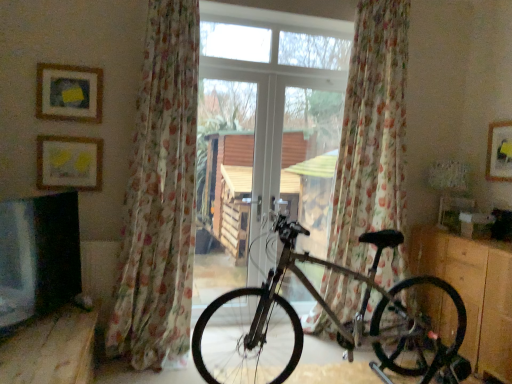
Describe the element at coordinates (499, 152) in the screenshot. I see `matte yellow picture frame at upper right, the 1th picture frame in the right-to-left sequence` at that location.

The height and width of the screenshot is (384, 512). What are the coordinates of `floral sheer curtain at left, the second curtain when ordered from right to left` in the screenshot? It's located at (160, 198).

In order to face floral sheer curtain at center, the 1th curtain positioned from the right, should I rotate leftwards or rightwards?

To align with it, rotate right about 15.535°.

At what (x,y) coordinates should I click in order to perform the action: click on silver metallic bicycle at center. Please return your answer as a coordinate pair (x, y). The width and height of the screenshot is (512, 384). Looking at the image, I should click on (329, 317).

What do you see at coordinates (329, 317) in the screenshot? This screenshot has width=512, height=384. I see `silver metallic bicycle at center` at bounding box center [329, 317].

The image size is (512, 384). I want to click on wooden dresser at lower right, so click(473, 292).

Is matte yellow picture frame at upper left, placed as the second picture frame when sorted from back to front, in front of or behind floral sheer curtain at center, which is counted as the 2th curtain, starting from the left, in the image?

matte yellow picture frame at upper left, placed as the second picture frame when sorted from back to front, is in front of floral sheer curtain at center, which is counted as the 2th curtain, starting from the left.

Considering the sizes of matte yellow picture frame at upper left, placed as the second picture frame when sorted from back to front, and floral sheer curtain at center, which is counted as the 2th curtain, starting from the left, in the image, is matte yellow picture frame at upper left, placed as the second picture frame when sorted from back to front, wider or thinner than floral sheer curtain at center, which is counted as the 2th curtain, starting from the left,?

matte yellow picture frame at upper left, placed as the second picture frame when sorted from back to front, is thinner than floral sheer curtain at center, which is counted as the 2th curtain, starting from the left.

Between matte yellow picture frame at upper left, marked as the third picture frame in a right-to-left arrangement, and floral sheer curtain at center, which is counted as the 2th curtain, starting from the left, which one has larger size?

floral sheer curtain at center, which is counted as the 2th curtain, starting from the left.

From the picture: From a real-world perspective, which object rests below the other?

matte yellow picture frame at upper left, marked as the third picture frame in a right-to-left arrangement, is physically lower.

Is transparent glass door at center looking in the opposite direction of matte gold picture frame at upper left, positioned as the 3th picture frame in back-to-front order?

No, transparent glass door at center is not facing the opposite direction of matte gold picture frame at upper left, positioned as the 3th picture frame in back-to-front order.

How distant is transparent glass door at center from matte gold picture frame at upper left, positioned as the 3th picture frame in back-to-front order?

A distance of 38.44 inches exists between transparent glass door at center and matte gold picture frame at upper left, positioned as the 3th picture frame in back-to-front order.

Are transparent glass door at center and matte gold picture frame at upper left, which ranks as the 1th picture frame in front-to-back order, making contact?

No, transparent glass door at center is not beside matte gold picture frame at upper left, which ranks as the 1th picture frame in front-to-back order.

Considering the sizes of transparent glass door at center and matte gold picture frame at upper left, which ranks as the 1th picture frame in front-to-back order, in the image, is transparent glass door at center taller or shorter than matte gold picture frame at upper left, which ranks as the 1th picture frame in front-to-back order,?

In the image, transparent glass door at center appears to be taller than matte gold picture frame at upper left, which ranks as the 1th picture frame in front-to-back order.

From the image's perspective, which one is positioned lower, matte gold picture frame at upper left, positioned as the 3th picture frame in back-to-front order, or wooden bench at lower left?

From the image's view, wooden bench at lower left is below.

Locate an element on the screen. This screenshot has width=512, height=384. the 3rd picture frame above when counting from the wooden bench at lower left (from the image's perspective) is located at coordinates (69, 93).

Is matte gold picture frame at upper left, the second picture frame in the right-to-left sequence, in front of wooden bench at lower left?

No.

From their relative heights in the image, would you say matte gold picture frame at upper left, positioned as the 3th picture frame in back-to-front order, is taller or shorter than wooden bench at lower left?

Clearly, matte gold picture frame at upper left, positioned as the 3th picture frame in back-to-front order, is shorter compared to wooden bench at lower left.

Is matte gold picture frame at upper left, the second picture frame in the right-to-left sequence, aimed at matte yellow picture frame at upper left, marked as the 2th picture frame in a front-to-back arrangement?

No, matte gold picture frame at upper left, the second picture frame in the right-to-left sequence, is not facing towards matte yellow picture frame at upper left, marked as the 2th picture frame in a front-to-back arrangement.

Is matte gold picture frame at upper left, positioned as the 3th picture frame in back-to-front order, not close to matte yellow picture frame at upper left, marked as the third picture frame in a right-to-left arrangement?

matte gold picture frame at upper left, positioned as the 3th picture frame in back-to-front order, is actually quite close to matte yellow picture frame at upper left, marked as the third picture frame in a right-to-left arrangement.

Is matte gold picture frame at upper left, which ranks as the 1th picture frame in front-to-back order, behind matte yellow picture frame at upper left, which is the first picture frame from left to right?

No, it is not.

From a real-world perspective, is floral sheer curtain at left, the second curtain when ordered from right to left, physically located above or below silver metallic bicycle at center?

In terms of real-world spatial position, floral sheer curtain at left, the second curtain when ordered from right to left, is above silver metallic bicycle at center.

Considering the sizes of objects floral sheer curtain at left, which is counted as the first curtain, starting from the left, and silver metallic bicycle at center in the image provided, who is shorter, floral sheer curtain at left, which is counted as the first curtain, starting from the left, or silver metallic bicycle at center?

Standing shorter between the two is silver metallic bicycle at center.

Considering the relative sizes of floral sheer curtain at left, which is counted as the first curtain, starting from the left, and silver metallic bicycle at center in the image provided, is floral sheer curtain at left, which is counted as the first curtain, starting from the left, thinner than silver metallic bicycle at center?

Correct, the width of floral sheer curtain at left, which is counted as the first curtain, starting from the left, is less than that of silver metallic bicycle at center.

Is floral sheer curtain at left, the second curtain when ordered from right to left, bigger or smaller than silver metallic bicycle at center?

Clearly, floral sheer curtain at left, the second curtain when ordered from right to left, is smaller in size than silver metallic bicycle at center.

Considering the sizes of floral sheer curtain at left, which is counted as the first curtain, starting from the left, and wooden dresser at lower right in the image, is floral sheer curtain at left, which is counted as the first curtain, starting from the left, wider or thinner than wooden dresser at lower right?

Considering their sizes, floral sheer curtain at left, which is counted as the first curtain, starting from the left, looks slimmer than wooden dresser at lower right.

Where is `dresser that is under the floral sheer curtain at left, which is counted as the first curtain, starting from the left (from a real-world perspective)`? dresser that is under the floral sheer curtain at left, which is counted as the first curtain, starting from the left (from a real-world perspective) is located at coordinates (473, 292).

Is floral sheer curtain at left, the second curtain when ordered from right to left, touching wooden dresser at lower right?

floral sheer curtain at left, the second curtain when ordered from right to left, is not next to wooden dresser at lower right, and they're not touching.

Is floral sheer curtain at left, which is counted as the first curtain, starting from the left, spatially inside wooden dresser at lower right, or outside of it?

floral sheer curtain at left, which is counted as the first curtain, starting from the left, is located beyond the bounds of wooden dresser at lower right.

From a real-world perspective, who is located lower, wooden dresser at lower right or floral sheer curtain at center, the 1th curtain positioned from the right?

wooden dresser at lower right, from a real-world perspective.

Find the location of a particular element. The image size is (512, 384). dresser located underneath the floral sheer curtain at center, the 1th curtain positioned from the right (from a real-world perspective) is located at coordinates (473, 292).

Looking at the image, does wooden dresser at lower right seem bigger or smaller compared to floral sheer curtain at center, the 1th curtain positioned from the right?

Clearly, wooden dresser at lower right is smaller in size than floral sheer curtain at center, the 1th curtain positioned from the right.

Is wooden dresser at lower right at the right side of floral sheer curtain at center, which is counted as the 2th curtain, starting from the left?

Indeed, wooden dresser at lower right is positioned on the right side of floral sheer curtain at center, which is counted as the 2th curtain, starting from the left.

Locate an element on the screen. picture frame below the floral sheer curtain at center, which is counted as the 2th curtain, starting from the left (from the image's perspective) is located at coordinates (69, 163).

Identify the location of window located underneath the matte gold picture frame at upper left, positioned as the 3th picture frame in back-to-front order (from a real-world perspective). This screenshot has height=384, width=512. (274, 121).

From the image, which object appears to be farther from wooden dresser at lower right, wooden bench at lower left or floral sheer curtain at center, the 1th curtain positioned from the right?

The object further to wooden dresser at lower right is wooden bench at lower left.

Estimate the real-world distances between objects in this image. Which object is further from wooden bench at lower left, matte yellow picture frame at upper right, the 1th picture frame in the right-to-left sequence, or floral sheer curtain at left, the second curtain when ordered from right to left?

matte yellow picture frame at upper right, the 1th picture frame in the right-to-left sequence, is positioned further to the anchor wooden bench at lower left.

Looking at the image, which one is located further to floral sheer curtain at center, the 1th curtain positioned from the right, wooden dresser at lower right or matte yellow picture frame at upper right, acting as the 1th picture frame starting from the back?

Based on the image, matte yellow picture frame at upper right, acting as the 1th picture frame starting from the back, appears to be further to floral sheer curtain at center, the 1th curtain positioned from the right.

Estimate the real-world distances between objects in this image. Which object is closer to matte yellow picture frame at upper left, marked as the third picture frame in a right-to-left arrangement, wooden bench at lower left or silver metallic bicycle at center?

wooden bench at lower left lies closer to matte yellow picture frame at upper left, marked as the third picture frame in a right-to-left arrangement, than the other object.

Looking at the image, which one is located further to wooden dresser at lower right, floral sheer curtain at left, the second curtain when ordered from right to left, or matte yellow picture frame at upper right, marked as the third picture frame in a left-to-right arrangement?

The object further to wooden dresser at lower right is floral sheer curtain at left, the second curtain when ordered from right to left.

From the image, which object appears to be nearer to matte yellow picture frame at upper right, which ranks as the 3th picture frame in front-to-back order, wooden bench at lower left or wooden dresser at lower right?

The object closer to matte yellow picture frame at upper right, which ranks as the 3th picture frame in front-to-back order, is wooden dresser at lower right.

Which object lies further to the anchor point floral sheer curtain at center, the 1th curtain positioned from the right, matte gold picture frame at upper left, which is counted as the second picture frame, starting from the left, or transparent glass door at center?

matte gold picture frame at upper left, which is counted as the second picture frame, starting from the left, is positioned further to the anchor floral sheer curtain at center, the 1th curtain positioned from the right.

From the image, which object appears to be nearer to floral sheer curtain at left, the second curtain when ordered from right to left, matte yellow picture frame at upper left, which is the first picture frame from left to right, or wooden bench at lower left?

matte yellow picture frame at upper left, which is the first picture frame from left to right.

I want to click on picture frame located between matte yellow picture frame at upper left, marked as the third picture frame in a right-to-left arrangement, and floral sheer curtain at left, which is counted as the first curtain, starting from the left, in the left-right direction, so click(x=69, y=93).

What are the coordinates of `furniture located between matte yellow picture frame at upper left, marked as the 2th picture frame in a front-to-back arrangement, and floral sheer curtain at center, which is counted as the 2th curtain, starting from the left, in the left-right direction` in the screenshot? It's located at (51, 350).

Image resolution: width=512 pixels, height=384 pixels. Identify the location of window between matte gold picture frame at upper left, which ranks as the 1th picture frame in front-to-back order, and floral sheer curtain at center, which is counted as the 2th curtain, starting from the left, from left to right. (274, 121).

You are a GUI agent. You are given a task and a screenshot of the screen. Output one action in this format:
    pyautogui.click(x=<x>, y=<y>)
    Task: Click on the dresser located between silver metallic bicycle at center and matte yellow picture frame at upper right, marked as the third picture frame in a left-to-right arrangement, in the left-right direction
    This screenshot has width=512, height=384.
    Given the screenshot: What is the action you would take?
    pyautogui.click(x=473, y=292)